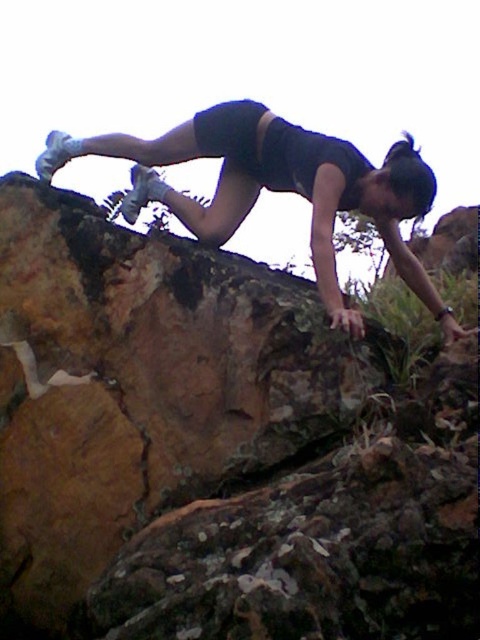
You are a photographer trying to capture the climber in the image. To ensure the brown rough rock at upper left and the matte black shorts at upper center are both in focus, which object should you focus on first considering their heights?

The brown rough rock at upper left is taller than the matte black shorts at upper center, so you should focus on the brown rough rock at upper left first to ensure both are in focus.

You are a photographer trying to capture the climber in the image. To ensure the brown rough rock at upper left and the matte black shorts at upper center are both clearly visible in the frame, which object should you focus on first?

You should focus on the brown rough rock at upper left first because it is in front of the matte black shorts at upper center. Since it is closer to the camera, focusing on it will ensure both objects remain in focus through the depth of field.

Consider the image. You are a photographer trying to capture the climber in the image. The brown rough rock at upper left and the matte black shorts at upper center are both in your viewfinder. Which object is wider?

The brown rough rock at upper left is wider than the matte black shorts at upper center because its width surpasses that of the shorts.